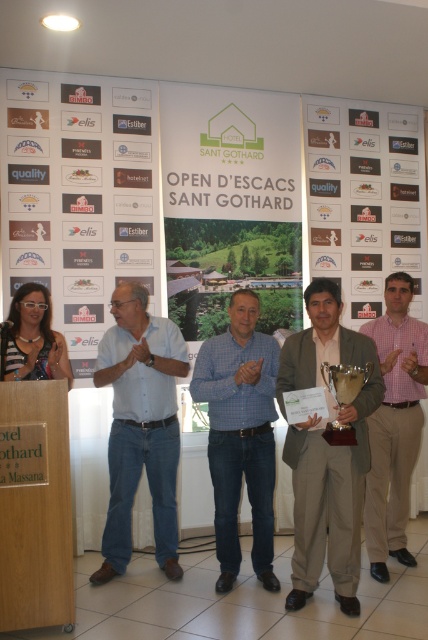
Question: Based on their relative distances, which object is farther from the gold metallic trophy at center?

Choices:
 (A) blue checkered shirt at center
 (B) white paper poster at left
 (C) matte brown suit at center
 (D) pink checkered shirt at center

Answer: (B)

Question: Based on their relative distances, which object is farther from the blue checkered shirt at center?

Choices:
 (A) gold metallic trophy at center
 (B) matte brown suit at center
 (C) white paper poster at left

Answer: (C)

Question: Can you confirm if white paper poster at left is positioned to the right of matte brown suit at center?

Choices:
 (A) yes
 (B) no

Answer: (B)

Question: Is the position of blue jeans at center less distant than that of gold metallic trophy at center?

Choices:
 (A) yes
 (B) no

Answer: (B)

Question: Which of these objects is positioned farthest from the blue jeans at center?

Choices:
 (A) pink checkered shirt at center
 (B) gold metallic trophy at center
 (C) white paper poster at left
 (D) blue checkered shirt at center

Answer: (A)

Question: Can you confirm if white paper poster at left is positioned to the right of pink checkered shirt at center?

Choices:
 (A) no
 (B) yes

Answer: (A)